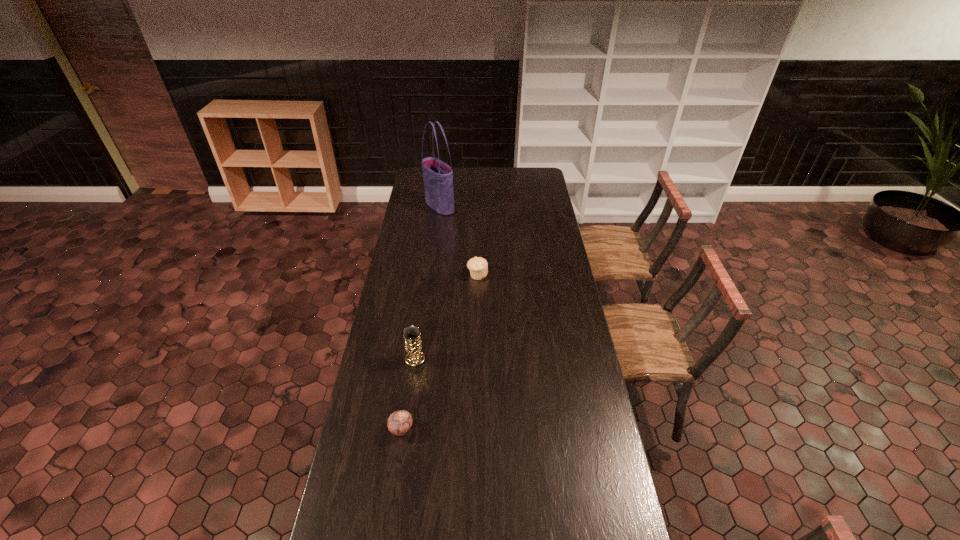
Locate an element on the screen. The height and width of the screenshot is (540, 960). free location that satisfies the following two spatial constraints: 1. on the back side of the farthest object; 2. on the left side of the second nearest object is located at coordinates 437,206.

At what (x,y) coordinates should I click in order to perform the action: click on free location that satisfies the following two spatial constraints: 1. on the back side of the left muffin; 2. on the right side of the tallest object. Please return your answer as a coordinate pair (x, y). This screenshot has width=960, height=540. Looking at the image, I should click on (434, 206).